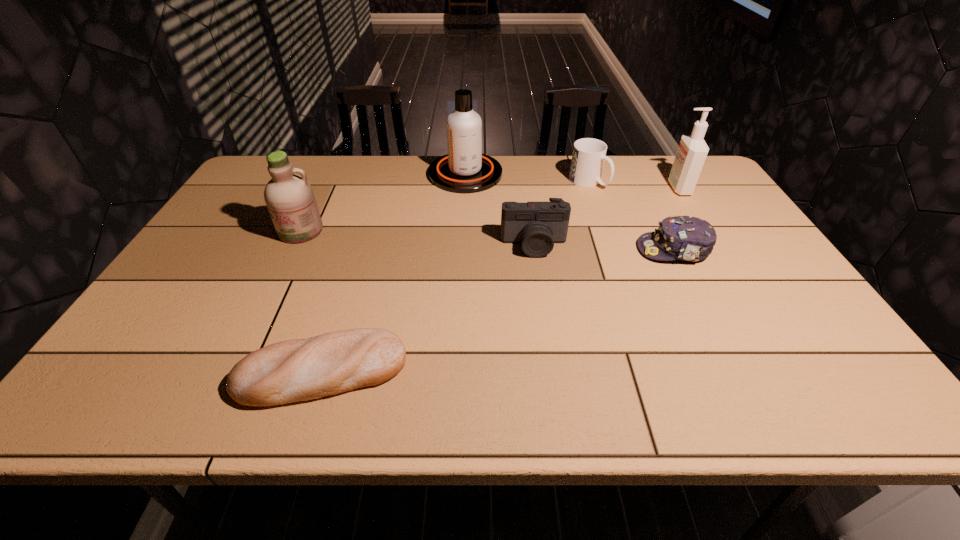
Image resolution: width=960 pixels, height=540 pixels. Find the location of `cleansing agent identified as the second closest to the fifth object from left to right`. cleansing agent identified as the second closest to the fifth object from left to right is located at coordinates pyautogui.click(x=464, y=169).

This screenshot has height=540, width=960. Find the location of `vacant point that satisfies the following two spatial constraints: 1. on the front label of the bread; 2. on the left side of the nearest cleansing agent`. vacant point that satisfies the following two spatial constraints: 1. on the front label of the bread; 2. on the left side of the nearest cleansing agent is located at coordinates (231, 372).

The image size is (960, 540). Identify the location of vacant region that satisfies the following two spatial constraints: 1. on the front label of the nearest cleansing agent; 2. on the right side of the nearest object. (231, 372).